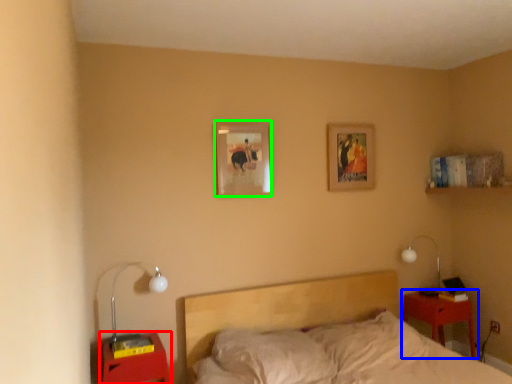
Question: Based on their relative distances, which object is nearer to nightstand (highlighted by a red box)? Choose from nightstand (highlighted by a blue box) and picture frame (highlighted by a green box).

Choices:
 (A) nightstand
 (B) picture frame

Answer: (B)